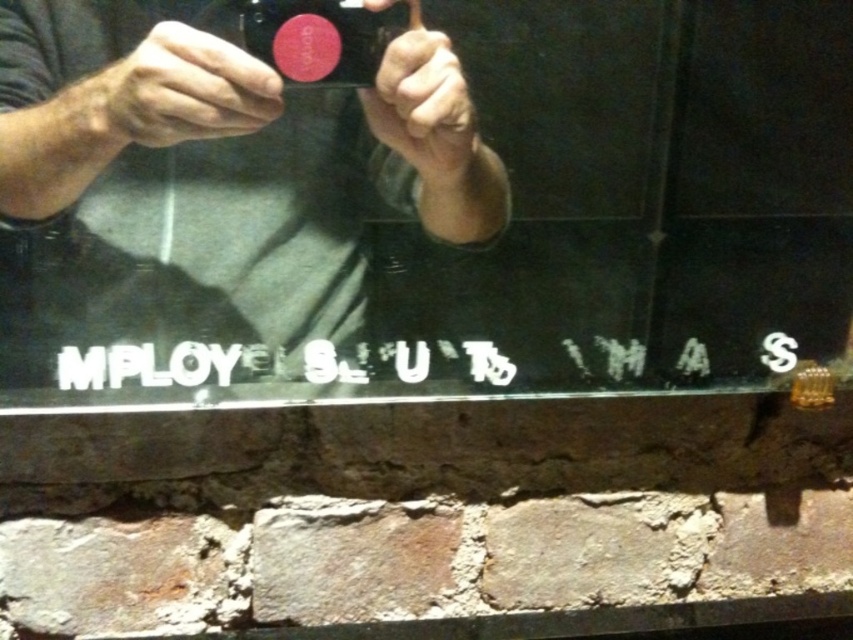
You are holding a smartphone with a red sticker and looking at the reflection on the glass. There is a gray matte shirt at center and a matte black camera at center in the reflection. Which object in the reflection takes up more space?

The gray matte shirt at center is bigger than the matte black camera at center, so it takes up more space in the reflection.

You are a photographer trying to capture the reflection of the gray matte shirt at center in the image. The reflection is centered at point (209, 179). If you want to adjust your phone to focus on this point, what coordinates should you aim for?

The gray matte shirt at center is located at point (209, 179), so you should aim the phone at those coordinates to focus on the reflection.